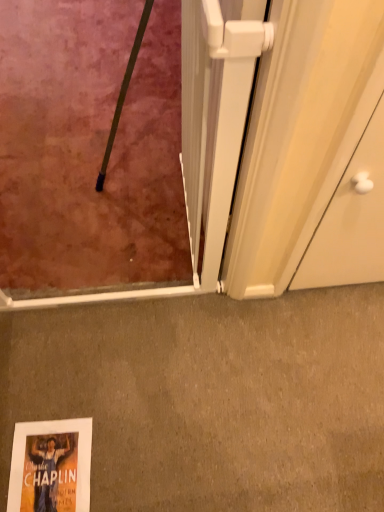
Question: From a real-world perspective, is matte gray carpet at lower center physically located above or below white plastic screen door at center?

Choices:
 (A) below
 (B) above

Answer: (A)

Question: Is matte gray carpet at lower center to the left or to the right of white plastic screen door at center in the image?

Choices:
 (A) right
 (B) left

Answer: (A)

Question: Looking at the image, does matte gray carpet at lower center seem bigger or smaller compared to white plastic screen door at center?

Choices:
 (A) small
 (B) big

Answer: (A)

Question: In terms of width, does white plastic screen door at center look wider or thinner when compared to matte gray carpet at lower center?

Choices:
 (A) thin
 (B) wide

Answer: (A)

Question: In the image, is white plastic screen door at center on the left side or the right side of matte gray carpet at lower center?

Choices:
 (A) left
 (B) right

Answer: (A)

Question: In the image, is white plastic screen door at center positioned in front of or behind matte gray carpet at lower center?

Choices:
 (A) front
 (B) behind

Answer: (A)

Question: Is point (221, 54) positioned closer to the camera than point (208, 423)?

Choices:
 (A) farther
 (B) closer

Answer: (B)